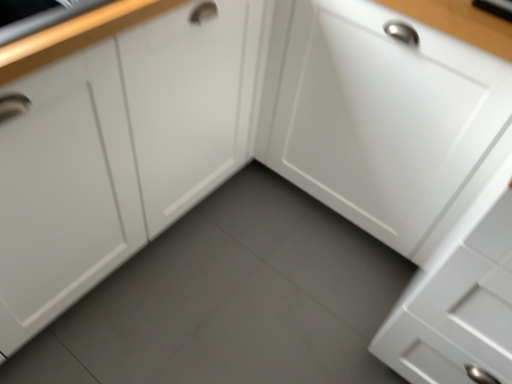
What do you see at coordinates (117, 153) in the screenshot? This screenshot has width=512, height=384. I see `white matte cabinet at center, the second cabinetry in the right-to-left sequence` at bounding box center [117, 153].

Find the location of a particular element. This screenshot has height=384, width=512. white matte cabinet at center, acting as the first cabinetry starting from the left is located at coordinates point(117,153).

What are the coordinates of `white matte cabinet door at center, positioned as the first cabinetry in right-to-left order` in the screenshot? It's located at (388, 121).

The height and width of the screenshot is (384, 512). Describe the element at coordinates (388, 121) in the screenshot. I see `white matte cabinet door at center, the 2th cabinetry from the left` at that location.

Identify the location of white matte cabinet at center, the second cabinetry in the right-to-left sequence. This screenshot has width=512, height=384. (117, 153).

Which is more to the right, white matte cabinet door at center, positioned as the first cabinetry in right-to-left order, or white matte cabinet at center, the second cabinetry in the right-to-left sequence?

white matte cabinet door at center, positioned as the first cabinetry in right-to-left order, is more to the right.

Which object is closer to the camera taking this photo, white matte cabinet door at center, the 2th cabinetry from the left, or white matte cabinet at center, the second cabinetry in the right-to-left sequence?

white matte cabinet at center, the second cabinetry in the right-to-left sequence.

Does point (394, 187) lie behind point (142, 96)?

That is True.

From the image's perspective, is white matte cabinet door at center, positioned as the first cabinetry in right-to-left order, located above or below white matte cabinet at center, acting as the first cabinetry starting from the left?

Based on their image positions, white matte cabinet door at center, positioned as the first cabinetry in right-to-left order, is located beneath white matte cabinet at center, acting as the first cabinetry starting from the left.

From a real-world perspective, is white matte cabinet door at center, the 2th cabinetry from the left, located beneath white matte cabinet at center, the second cabinetry in the right-to-left sequence?

Yes, from a real-world perspective, white matte cabinet door at center, the 2th cabinetry from the left, is under white matte cabinet at center, the second cabinetry in the right-to-left sequence.

Which object is thinner, white matte cabinet door at center, positioned as the first cabinetry in right-to-left order, or white matte cabinet at center, the second cabinetry in the right-to-left sequence?

white matte cabinet door at center, positioned as the first cabinetry in right-to-left order, is thinner.

Can you confirm if white matte cabinet door at center, positioned as the first cabinetry in right-to-left order, is shorter than white matte cabinet at center, the second cabinetry in the right-to-left sequence?

No.

Looking at this image, is white matte cabinet door at center, positioned as the first cabinetry in right-to-left order, bigger than white matte cabinet at center, the second cabinetry in the right-to-left sequence?

Actually, white matte cabinet door at center, positioned as the first cabinetry in right-to-left order, might be smaller than white matte cabinet at center, the second cabinetry in the right-to-left sequence.

Choose the correct answer: Is white matte cabinet door at center, positioned as the first cabinetry in right-to-left order, inside white matte cabinet at center, the second cabinetry in the right-to-left sequence, or outside it?

The correct answer is: outside.

Is white matte cabinet door at center, positioned as the first cabinetry in right-to-left order, positioned far away from white matte cabinet at center, the second cabinetry in the right-to-left sequence?

No, white matte cabinet door at center, positioned as the first cabinetry in right-to-left order, is not far from white matte cabinet at center, the second cabinetry in the right-to-left sequence.

Could you tell me if white matte cabinet door at center, the 2th cabinetry from the left, is facing white matte cabinet at center, the second cabinetry in the right-to-left sequence?

No, white matte cabinet door at center, the 2th cabinetry from the left, is not oriented towards white matte cabinet at center, the second cabinetry in the right-to-left sequence.

How different are the orientations of white matte cabinet door at center, the 2th cabinetry from the left, and white matte cabinet at center, the second cabinetry in the right-to-left sequence, in degrees?

90 degrees separate the facing orientations of white matte cabinet door at center, the 2th cabinetry from the left, and white matte cabinet at center, the second cabinetry in the right-to-left sequence.

Measure the distance from white matte cabinet door at center, the 2th cabinetry from the left, to white matte cabinet at center, the second cabinetry in the right-to-left sequence.

The distance of white matte cabinet door at center, the 2th cabinetry from the left, from white matte cabinet at center, the second cabinetry in the right-to-left sequence, is 18.82 inches.

Locate an element on the screen. This screenshot has width=512, height=384. cabinetry above the white matte cabinet door at center, positioned as the first cabinetry in right-to-left order (from the image's perspective) is located at coordinates (117, 153).

Which object is positioned more to the right, white matte cabinet at center, the second cabinetry in the right-to-left sequence, or white matte cabinet door at center, positioned as the first cabinetry in right-to-left order?

From the viewer's perspective, white matte cabinet door at center, positioned as the first cabinetry in right-to-left order, appears more on the right side.

Which is in front, white matte cabinet at center, the second cabinetry in the right-to-left sequence, or white matte cabinet door at center, positioned as the first cabinetry in right-to-left order?

Positioned in front is white matte cabinet at center, the second cabinetry in the right-to-left sequence.

Is point (39, 244) behind point (388, 156)?

No, (39, 244) is in front of (388, 156).

From the image's perspective, which is above, white matte cabinet at center, the second cabinetry in the right-to-left sequence, or white matte cabinet door at center, positioned as the first cabinetry in right-to-left order?

From the image's view, white matte cabinet at center, the second cabinetry in the right-to-left sequence, is above.

From a real-world perspective, is white matte cabinet at center, acting as the first cabinetry starting from the left, below white matte cabinet door at center, the 2th cabinetry from the left?

No, from a real-world perspective, white matte cabinet at center, acting as the first cabinetry starting from the left, is not under white matte cabinet door at center, the 2th cabinetry from the left.

Looking at their sizes, would you say white matte cabinet at center, the second cabinetry in the right-to-left sequence, is wider or thinner than white matte cabinet door at center, the 2th cabinetry from the left?

Considering their sizes, white matte cabinet at center, the second cabinetry in the right-to-left sequence, looks broader than white matte cabinet door at center, the 2th cabinetry from the left.

Who is shorter, white matte cabinet at center, acting as the first cabinetry starting from the left, or white matte cabinet door at center, positioned as the first cabinetry in right-to-left order?

white matte cabinet at center, acting as the first cabinetry starting from the left.

Considering the relative sizes of white matte cabinet at center, the second cabinetry in the right-to-left sequence, and white matte cabinet door at center, positioned as the first cabinetry in right-to-left order, in the image provided, is white matte cabinet at center, the second cabinetry in the right-to-left sequence, bigger than white matte cabinet door at center, positioned as the first cabinetry in right-to-left order,?

Correct, white matte cabinet at center, the second cabinetry in the right-to-left sequence, is larger in size than white matte cabinet door at center, positioned as the first cabinetry in right-to-left order.

Is white matte cabinet at center, the second cabinetry in the right-to-left sequence, positioned beyond the bounds of white matte cabinet door at center, the 2th cabinetry from the left?

Result: Absolutely, white matte cabinet at center, the second cabinetry in the right-to-left sequence, is external to white matte cabinet door at center, the 2th cabinetry from the left.

Is white matte cabinet at center, the second cabinetry in the right-to-left sequence, turned away from white matte cabinet door at center, the 2th cabinetry from the left?

No, white matte cabinet at center, the second cabinetry in the right-to-left sequence, is not facing away from white matte cabinet door at center, the 2th cabinetry from the left.

Consider the image. How distant is white matte cabinet at center, the second cabinetry in the right-to-left sequence, from white matte cabinet door at center, the 2th cabinetry from the left?

white matte cabinet at center, the second cabinetry in the right-to-left sequence, is 18.82 inches from white matte cabinet door at center, the 2th cabinetry from the left.

At what (x,y) coordinates should I click in order to perform the action: click on cabinetry in front of the white matte cabinet door at center, positioned as the first cabinetry in right-to-left order. Please return your answer as a coordinate pair (x, y). Looking at the image, I should click on (117, 153).

The width and height of the screenshot is (512, 384). Identify the location of cabinetry above the white matte cabinet door at center, the 2th cabinetry from the left (from a real-world perspective). (117, 153).

Where is `cabinetry that appears in front of the white matte cabinet door at center, positioned as the first cabinetry in right-to-left order`? Image resolution: width=512 pixels, height=384 pixels. cabinetry that appears in front of the white matte cabinet door at center, positioned as the first cabinetry in right-to-left order is located at coordinates (117, 153).